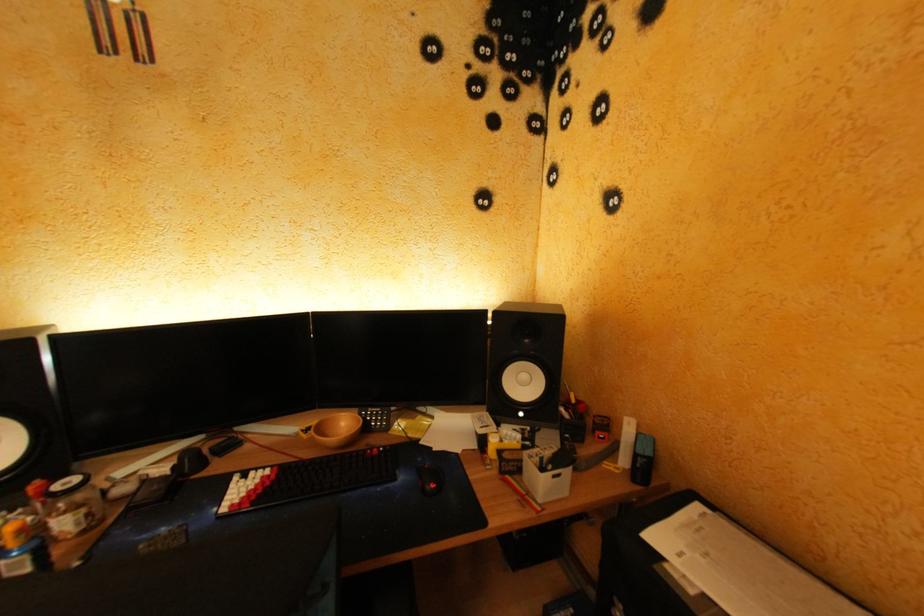
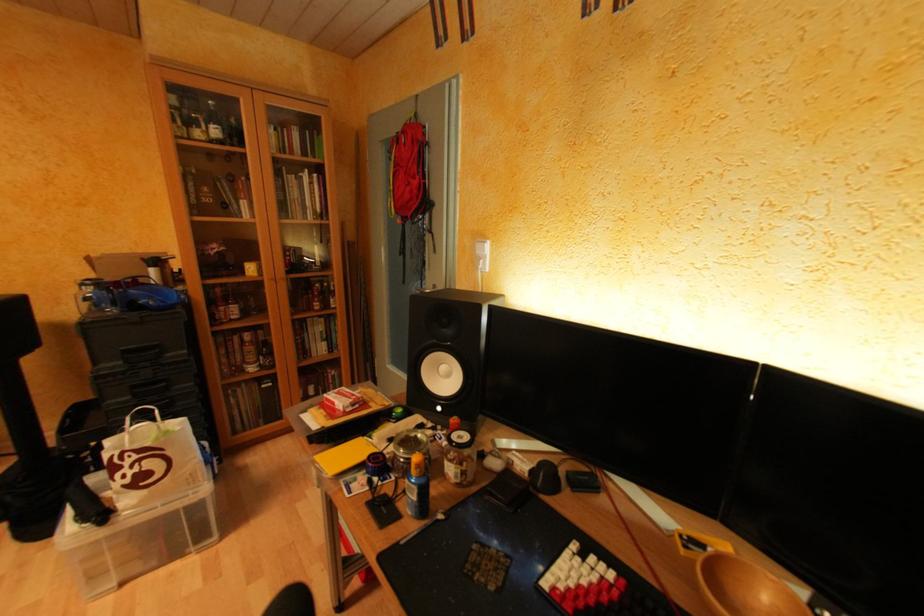
Question: The camera is either moving clockwise (left) or counter-clockwise (right) around the object. The first image is from the beginning of the video and the second image is from the end. Is the camera moving left or right when shooting the video?

Choices:
 (A) Left
 (B) Right

Answer: (B)